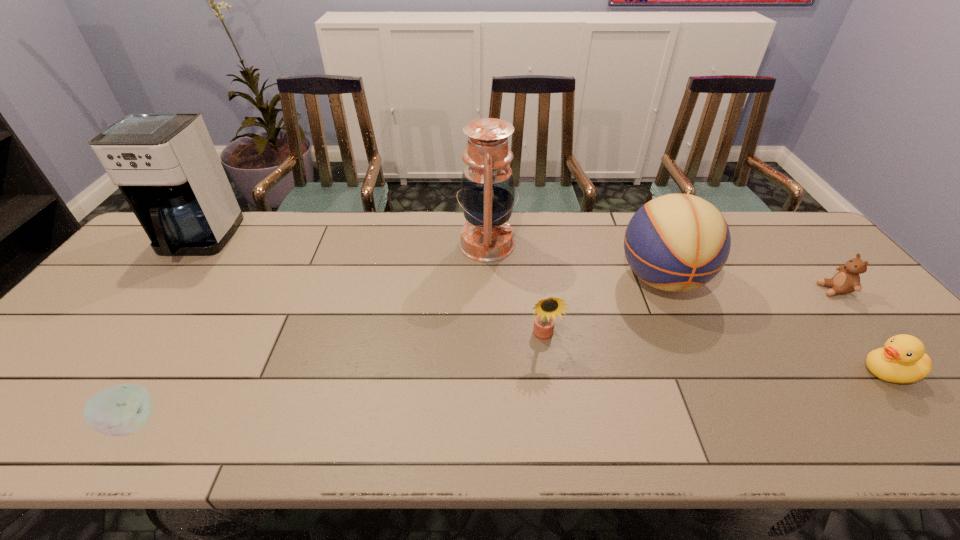
The width and height of the screenshot is (960, 540). In the image, there is a desktop. Identify the location of free region at the near edge. (835, 421).

Identify the location of vacant area at the left edge. The image size is (960, 540). (41, 390).

At what (x,y) coordinates should I click in order to perform the action: click on free space at the right edge. Please return your answer as a coordinate pair (x, y). Looking at the image, I should click on (830, 288).

This screenshot has width=960, height=540. What are the coordinates of `vacant space that is in between the fourth shortest object and the oil lamp` in the screenshot? It's located at (516, 291).

This screenshot has width=960, height=540. Identify the location of vacant space that is in between the fourth object from left to right and the basketball. (603, 308).

I want to click on vacant point located between the apple and the duck, so click(510, 397).

At what (x,y) coordinates should I click in order to perform the action: click on free space between the teddy bear and the nearest object. Please return your answer as a coordinate pair (x, y). This screenshot has width=960, height=540. Looking at the image, I should click on [x=483, y=356].

Find the location of a particular element. vacant area between the teddy bear and the coffee maker is located at coordinates (516, 266).

This screenshot has height=540, width=960. Identify the location of empty space that is in between the fifth object from right to left and the basketball. (574, 262).

Where is `free point between the basketball and the duck`? The image size is (960, 540). free point between the basketball and the duck is located at coordinates (775, 326).